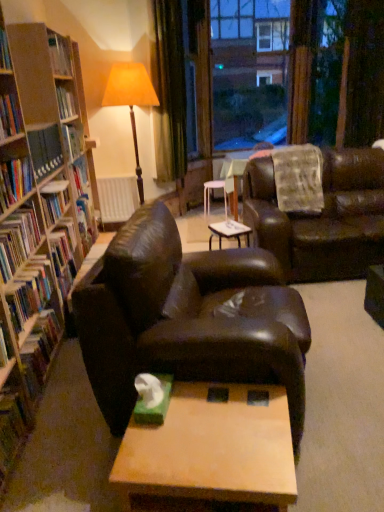
Locate an element on the screen. free location to the right of shiny brown leather couch at center, acting as the 1th studio couch starting from the front is located at coordinates (340, 361).